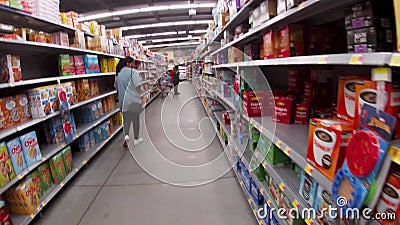
Locate an element on the screen. toy is located at coordinates (361, 147).